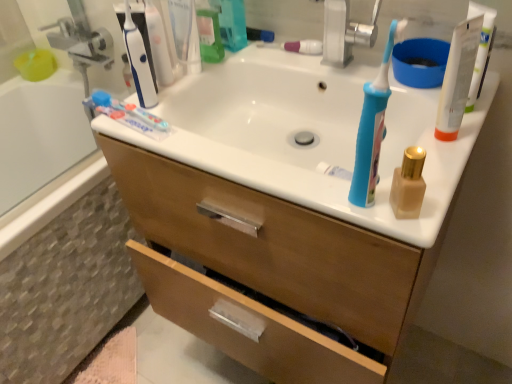
Question: Considering the positions of point (458, 74) and point (305, 51), is point (458, 74) closer or farther from the camera than point (305, 51)?

Choices:
 (A) farther
 (B) closer

Answer: (B)

Question: Is white plastic tube at upper right to the left or to the right of pink glossy toothpaste at center, the second toothpaste positioned from the bottom, in the image?

Choices:
 (A) left
 (B) right

Answer: (B)

Question: Which object is positioned farthest from the white glossy sink at center?

Choices:
 (A) white glossy toothpaste at upper left, arranged as the 2th toothpaste when viewed from the back
 (B) pink glossy toothpaste at center, arranged as the second toothpaste when viewed from the left
 (C) wooden cabinet at center
 (D) blue plastic toothbrush at upper right
 (E) matte gold bottle at right

Answer: (E)

Question: Which of these objects is positioned closest to the white glossy sink at center?

Choices:
 (A) matte gold bottle at right
 (B) white plastic tube at upper right
 (C) pink glossy toothpaste at center, the first toothpaste from the back
 (D) blue plastic toothbrush at upper right
 (E) wooden cabinet at center

Answer: (E)